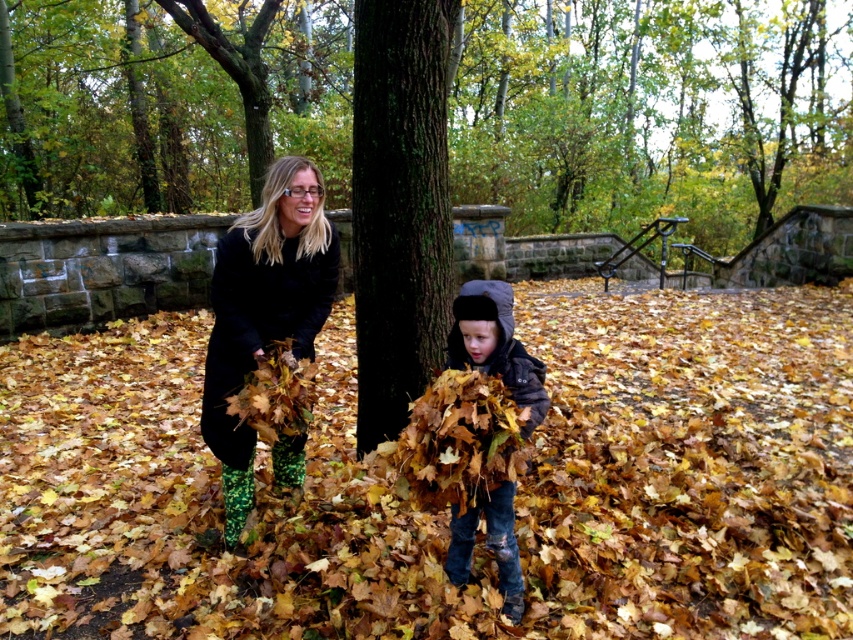
You are standing in the park and see the green rough bark tree at center. Can you tell me its exact location in terms of coordinates?

The green rough bark tree at center is located at coordinates point (x=653, y=112).

You are standing in the park and see the dark green textured bark at center. If you want to find its exact location using a coordinate system where the bottom left corner is the origin, what are its coordinates?

The dark green textured bark at center is located at coordinates point (399, 205).

You are a hiker who wants to climb the tallest tree in the park. Based on the image, which tree should you choose between the green rough bark tree at center and the dark green textured bark at center?

The green rough bark tree at center is taller than the dark green textured bark at center, so you should choose the green rough bark tree at center to climb.